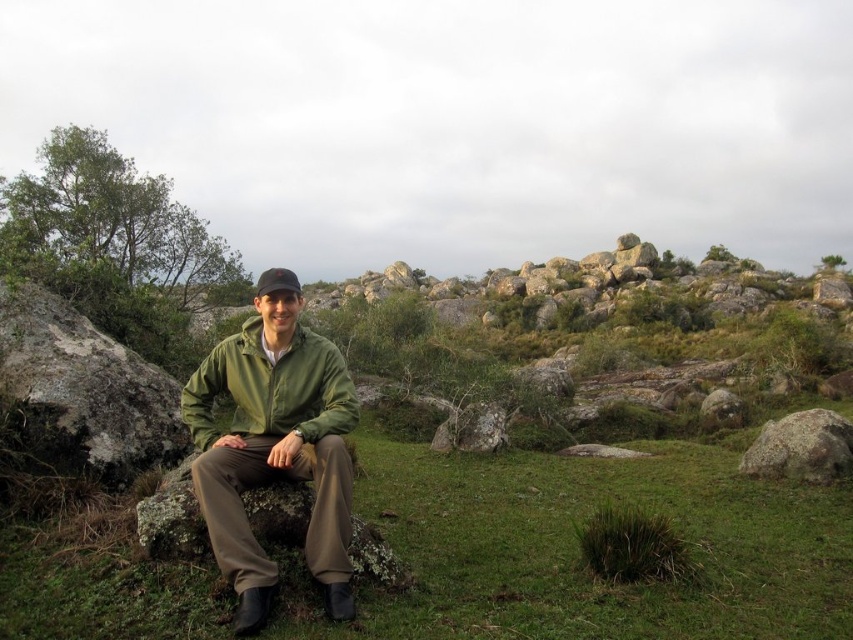
You are a photographer trying to capture a portrait of the person wearing the black fabric cap at center. To avoid including the smooth gray rock at center in the background, should you adjust your camera position upwards or downwards?

The smooth gray rock at center is located below the black fabric cap at center, so to avoid including it in the background, you should adjust your camera position upwards.

You are planning to place a decorative item on the smooth gray rock at center and the black fabric cap at center. Which object has a wider surface to place the item?

The black fabric cap at center has a wider surface than the smooth gray rock at center since the smooth gray rock at center is narrower.

You are planning to place a small garden ornament that requires a base of at least 30 cm in width. Based on the image, which of the two rocks, the rusty rock at right or the smooth gray rock at center, would be suitable for this purpose?

The rusty rock at right is wider than the smooth gray rock at center. Since the ornament requires a base of at least 30 cm, the rusty rock at right would be suitable if its width meets or exceeds the requirement, but the smooth gray rock at center may not be sufficient.